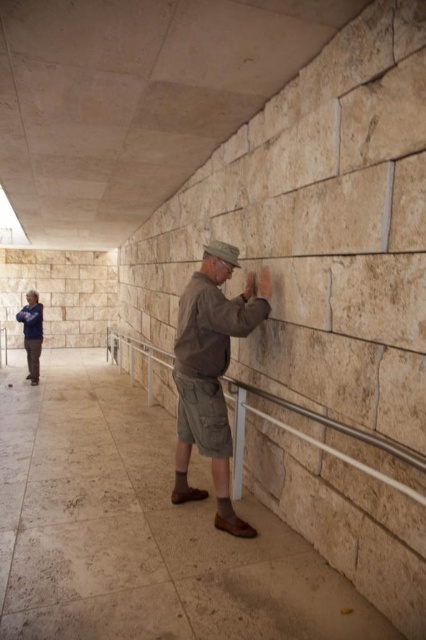
Question: Is the position of satin silver railing at center more distant than that of blue cotton shirt at lower left?

Choices:
 (A) yes
 (B) no

Answer: (B)

Question: Does satin silver railing at center appear on the right side of blue cotton shirt at lower left?

Choices:
 (A) no
 (B) yes

Answer: (B)

Question: Among these objects, which one is farthest from the camera?

Choices:
 (A) blue cotton shirt at lower left
 (B) satin silver railing at center

Answer: (A)

Question: Among these objects, which one is farthest from the camera?

Choices:
 (A) satin silver railing at center
 (B) brown cotton shirt at center
 (C) blue cotton shirt at lower left

Answer: (C)

Question: Which point appears farthest from the camera in this image?

Choices:
 (A) (218, 474)
 (B) (31, 376)

Answer: (B)

Question: Does satin silver railing at center appear over blue cotton shirt at lower left?

Choices:
 (A) no
 (B) yes

Answer: (A)